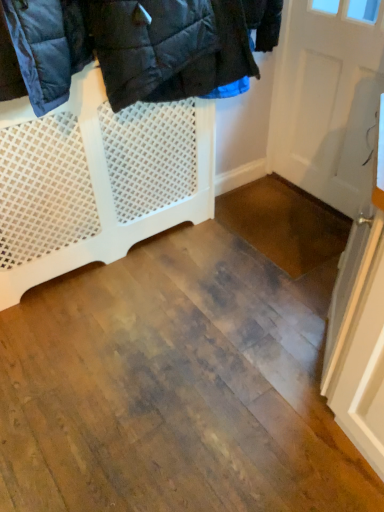
Where is `vacant area that lies to the right of white mesh gate at upper left`? The width and height of the screenshot is (384, 512). vacant area that lies to the right of white mesh gate at upper left is located at coordinates (241, 254).